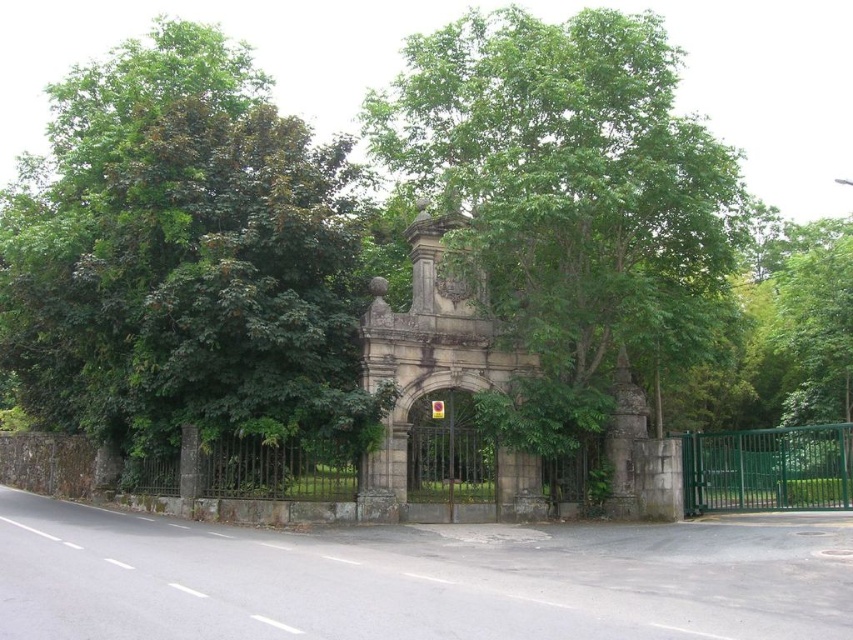
Which is below, green leafy tree at left or green metallic gate at center?

Positioned lower is green metallic gate at center.

Is point (91, 244) closer to camera compared to point (747, 468)?

Yes.

In order to click on green leafy tree at left in this screenshot , I will do `click(183, 257)`.

Is green metallic gate at center taller than stone archway at center?

Incorrect, green metallic gate at center's height is not larger of stone archway at center's.

Which is behind, point (706, 492) or point (483, 520)?

The point (706, 492) is more distant.

Who is more distant from viewer, (x=762, y=428) or (x=448, y=477)?

The point (x=762, y=428) is more distant.

Locate an element on the screen. Image resolution: width=853 pixels, height=640 pixels. green metallic gate at center is located at coordinates (767, 468).

Based on the photo, which of these two, green leafy tree at left or green leafy tree at center, stands taller?

With more height is green leafy tree at left.

From the picture: Who is positioned more to the left, green leafy tree at left or green leafy tree at center?

From the viewer's perspective, green leafy tree at left appears more on the left side.

Who is more forward, (265,237) or (521,268)?

Point (265,237)

Where is `green leafy tree at left`? The width and height of the screenshot is (853, 640). green leafy tree at left is located at coordinates (183, 257).